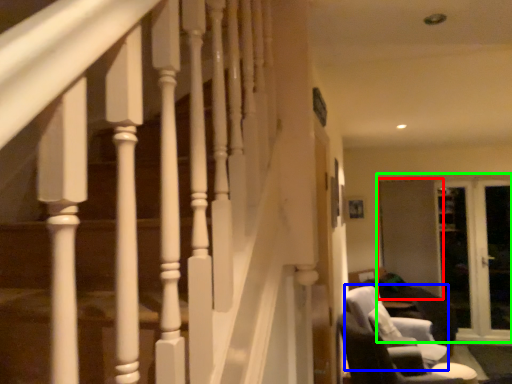
Question: Which is nearer to the screen door (highlighted by a red box)? swivel chair (highlighted by a blue box) or screen door (highlighted by a green box).

Choices:
 (A) swivel chair
 (B) screen door

Answer: (B)